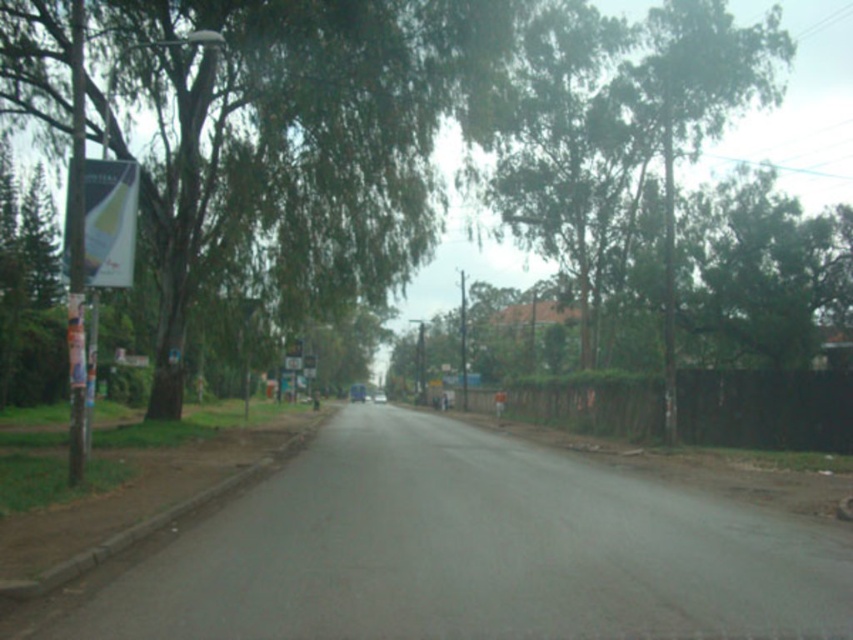
You are a pedestrian standing on the road and want to read the text on the white glossy banner at left. The green leafy tree at left is blocking your view. Can you move to the right side of the road to see the banner clearly?

The green leafy tree at left is in front of the white glossy banner at left, so moving to the right side of the road might provide a better angle to see the banner without obstruction from the tree.

You are a pedestrian standing on the road looking ahead. You see the green leafy tree at left and the white glossy banner at left. Which object is higher from the ground?

The green leafy tree at left is above the white glossy banner at left, so the green leafy tree at left is higher from the ground.

You are standing at the center of the road and want to reach the signpost on the left side. Which direction should you walk to avoid the green leafy tree at left?

The green leafy tree at left is located at point (296, 141), so you should walk towards the right side of the road to avoid it.